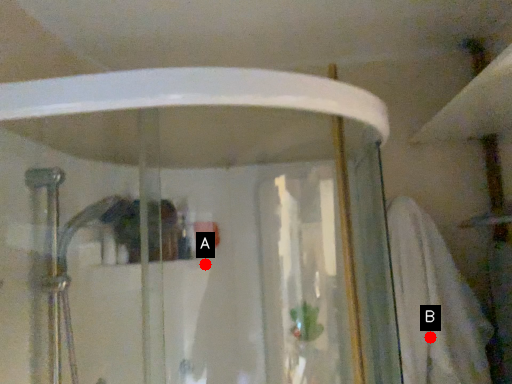
Question: Two points are circled on the image, labeled by A and B beside each circle. Which of the following is the farthest from the observer?

Choices:
 (A) A is further
 (B) B is further

Answer: (B)